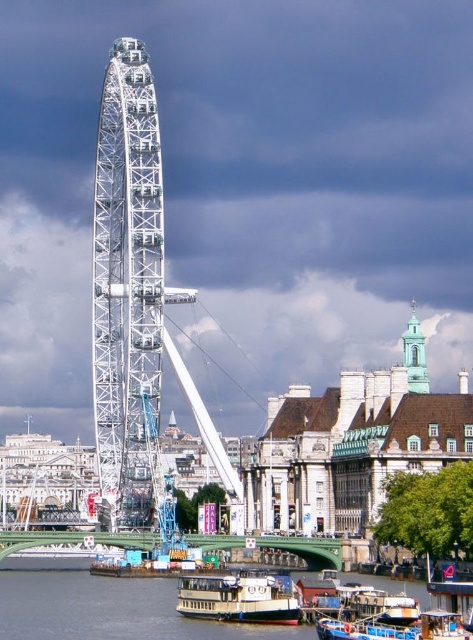
You are an architect planning to build a new observation deck. You need to know which structure is wider between the white metallic ferris wheel at center and the light blue glass tower at upper right. Which one is wider?

The light blue glass tower at upper right is wider than the white metallic ferris wheel at center according to the description.

You are a tourist standing on the riverbank and want to take a photo of both the smooth water at lower center and the light blue glass tower at upper right. Which object will appear smaller in your photo?

The smooth water at lower center will appear smaller in the photo because it is not as tall as the light blue glass tower at upper right.